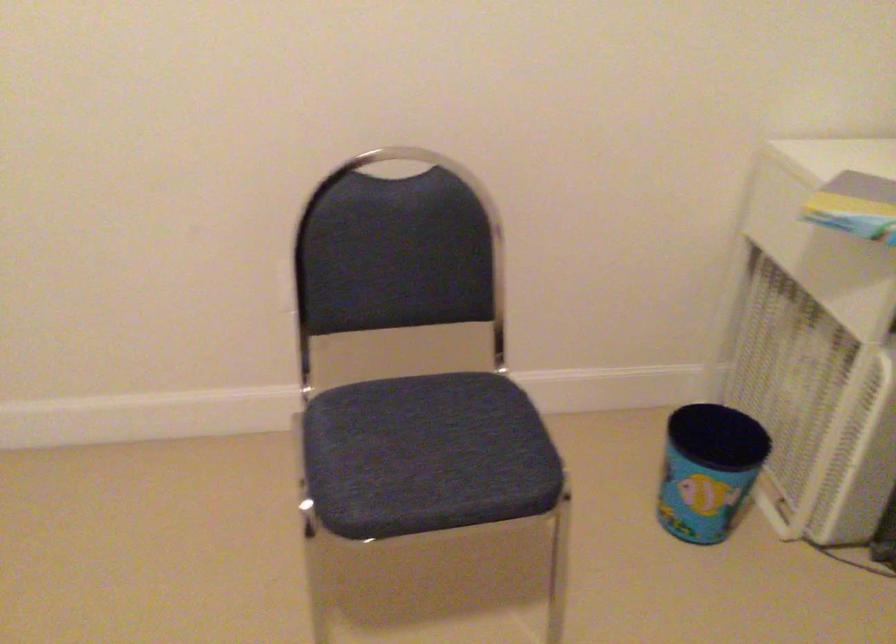
Find where to lift the small blue bucket. Please return your answer as a coordinate pair (x, y).

(708, 469)